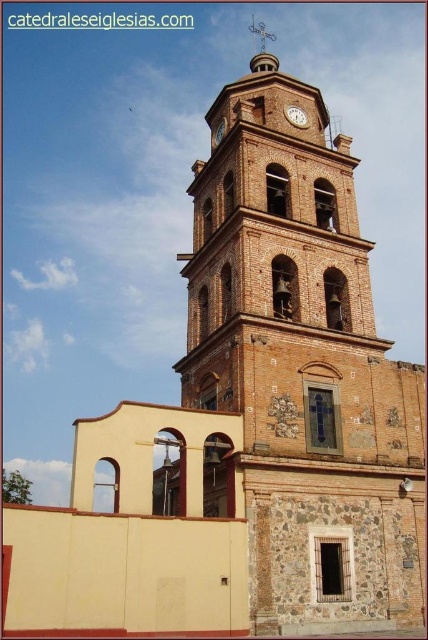
You are standing directly in front of the historic church tower. Where is the polished copper cross at center top positioned relative to the tower?

The polished copper cross at center top is located at point coordinates 0.077 on the x and 0.614 on the y axis, which places it at the center top of the tower as described.